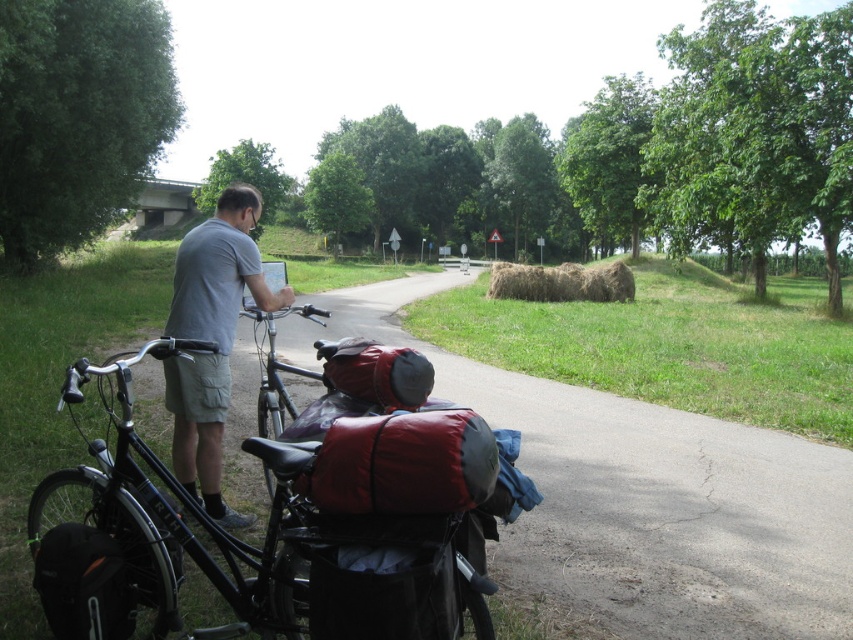
Question: Observing the image, what is the correct spatial positioning of black matte bicycle at left in reference to brown straw bale at center?

Choices:
 (A) left
 (B) right

Answer: (A)

Question: Estimate the real-world distances between objects in this image. Which object is closer to the brown straw bale at center?

Choices:
 (A) gray cotton shirt at left
 (B) black matte bicycle at left

Answer: (B)

Question: Which point appears closest to the camera in this image?

Choices:
 (A) click(x=585, y=285)
 (B) click(x=192, y=408)

Answer: (B)

Question: Considering the relative positions of black matte bicycle at left and brown straw bale at center in the image provided, where is black matte bicycle at left located with respect to brown straw bale at center?

Choices:
 (A) above
 (B) below

Answer: (B)

Question: Among these points, which one is nearest to the camera?

Choices:
 (A) (570, 275)
 (B) (456, 580)
 (C) (260, 282)

Answer: (B)

Question: Observing the image, what is the correct spatial positioning of gray cotton shirt at left in reference to brown straw bale at center?

Choices:
 (A) left
 (B) right

Answer: (A)